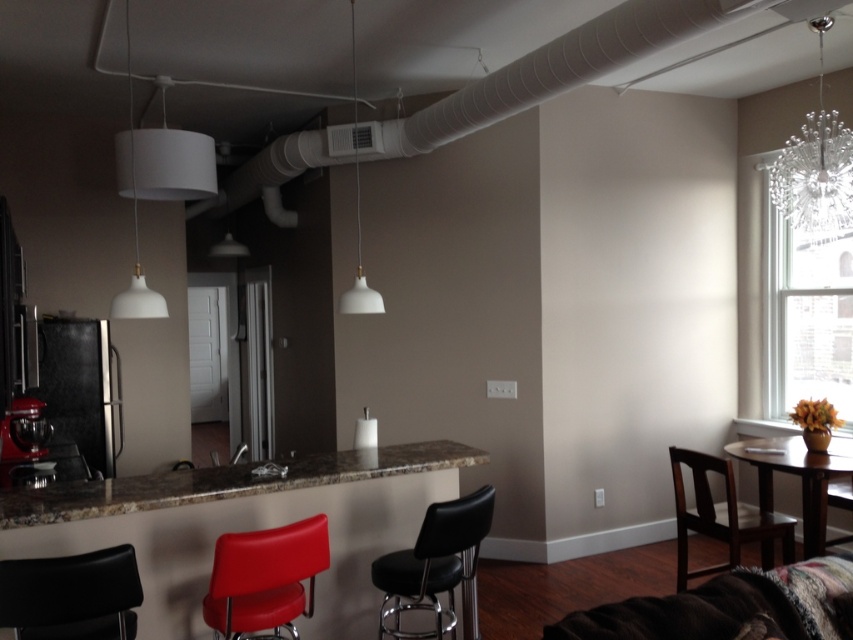
You are a delivery person trying to bring a large package into the kitchen. The package is 1.2 meters wide. You see the clear glass chandelier at upper right and the black leather chair at lower left. Can you fit the package through the space between them?

The clear glass chandelier at upper right might be wider than the black leather chair at lower left, so the space between them may not be wide enough for the 1.2 meter package. Check the actual width before attempting to move the package through.

You are planning to host a dinner party and need to seat guests comfortably. Given the space constraints in the kitchen area, which of the two seating options, the matte red chair at lower center or the black leather bar stool at center, would allow more guests to be seated without overcrowding?

The matte red chair at lower center occupies less space than the black leather bar stool at center, so using the matte red chair at lower center would allow more guests to be seated without overcrowding.